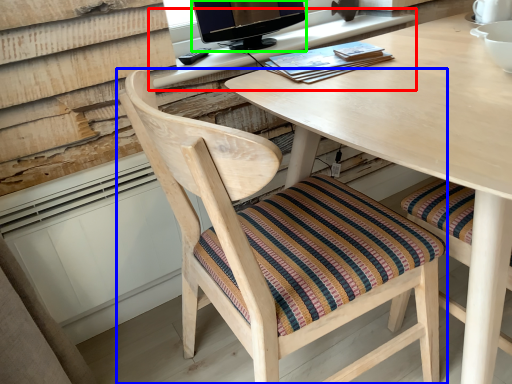
Question: Which object is the farthest from computer desk (highlighted by a red box)? Choose among these: chair (highlighted by a blue box) or television (highlighted by a green box).

Choices:
 (A) chair
 (B) television

Answer: (A)